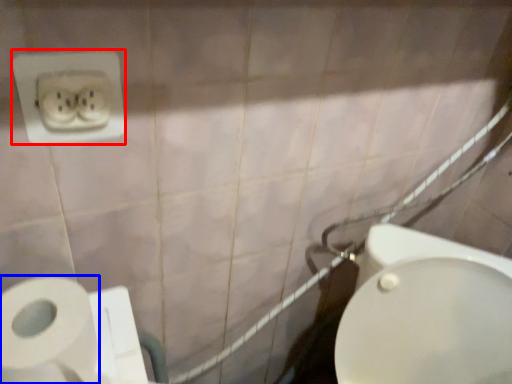
Question: Among these objects, which one is nearest to the camera, power plugs and sockets (highlighted by a red box) or toilet paper (highlighted by a blue box)?

Choices:
 (A) power plugs and sockets
 (B) toilet paper

Answer: (B)